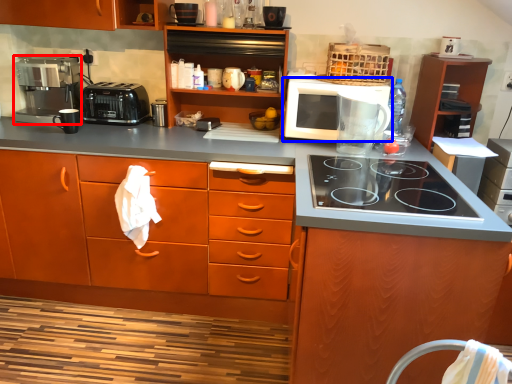
Question: Among these objects, which one is nearest to the camera, home appliance (highlighted by a red box) or microwave oven (highlighted by a blue box)?

Choices:
 (A) home appliance
 (B) microwave oven

Answer: (B)